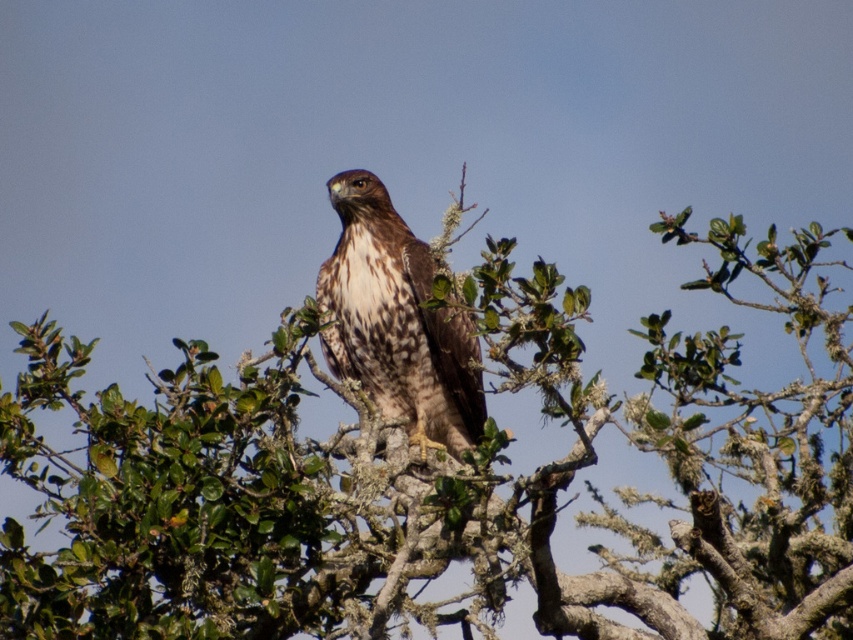
Is green leafy tree at center taller than brown speckled eagle at center?

Correct, green leafy tree at center is much taller as brown speckled eagle at center.

Which of these two, green leafy tree at center or brown speckled eagle at center, stands shorter?

Standing shorter between the two is brown speckled eagle at center.

Is point (358, 596) farther from viewer compared to point (347, 212)?

No.

The width and height of the screenshot is (853, 640). What are the coordinates of `green leafy tree at center` in the screenshot? It's located at (434, 476).